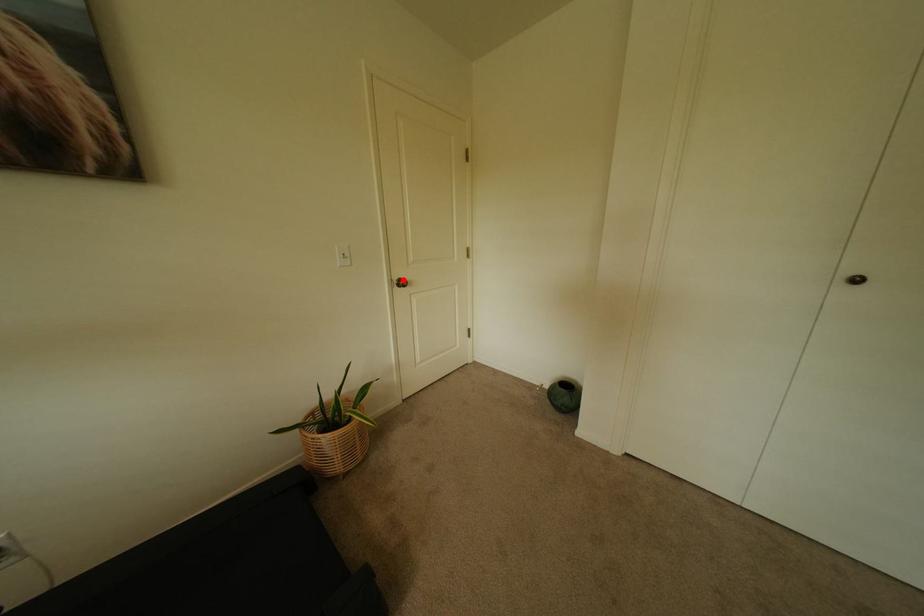
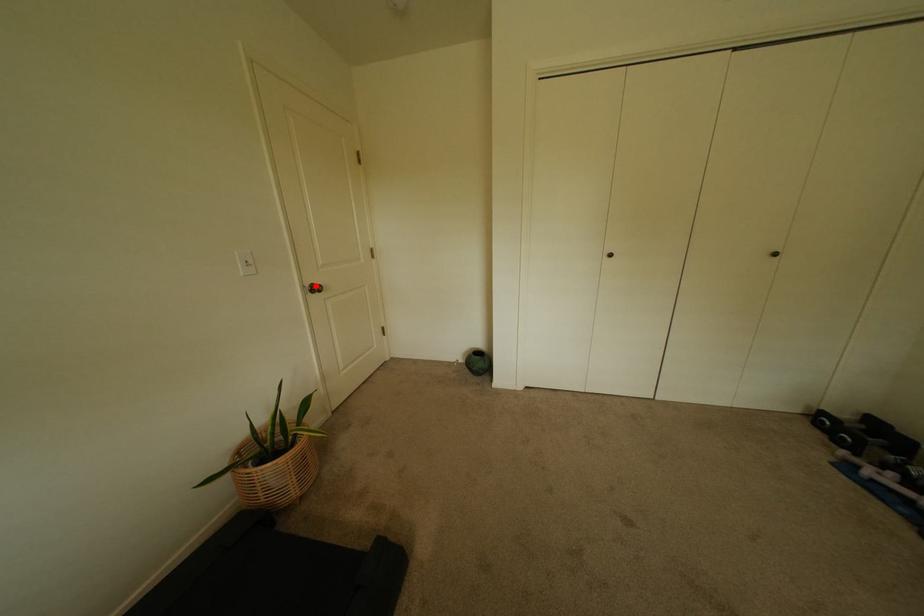
I am providing you with two images of the same scene from different viewpoints. A red point is marked on the first image and another point is marked on the second image. Do the highlighted points in image1 and image2 indicate the same real-world spot?

Yes